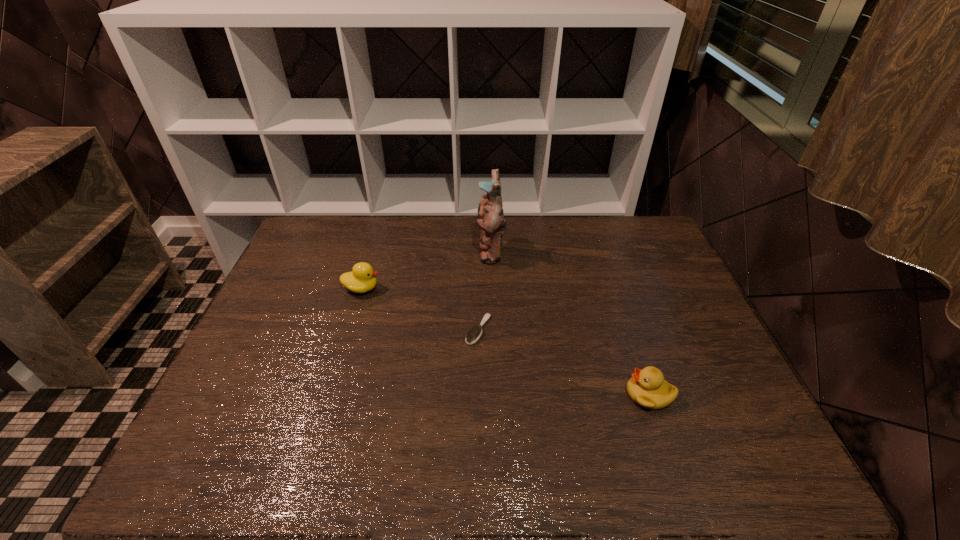
Locate an element on the screen. The image size is (960, 540). the tallest object is located at coordinates (490, 218).

I want to click on the farthest object, so click(490, 218).

Identify the location of the farther duckling. (361, 279).

Where is `the left duckling`? The image size is (960, 540). the left duckling is located at coordinates (361, 279).

Locate an element on the screen. The width and height of the screenshot is (960, 540). the nearest object is located at coordinates (647, 387).

Identify the location of the right duckling. Image resolution: width=960 pixels, height=540 pixels. (647, 387).

You are a GUI agent. You are given a task and a screenshot of the screen. Output one action in this format:
    pyautogui.click(x=<x>, y=<y>)
    Task: Click on the third farthest object
    This screenshot has height=540, width=960.
    Given the screenshot: What is the action you would take?
    pyautogui.click(x=473, y=335)

Find the location of a particular element. This screenshot has width=960, height=540. scrubbing brush is located at coordinates (473, 335).

This screenshot has width=960, height=540. Identify the location of vacant point located 0.120m on the front-facing side of the tallest object. (442, 252).

Image resolution: width=960 pixels, height=540 pixels. In order to click on vacant region located on the front-facing side of the tallest object in this screenshot , I will do `click(360, 252)`.